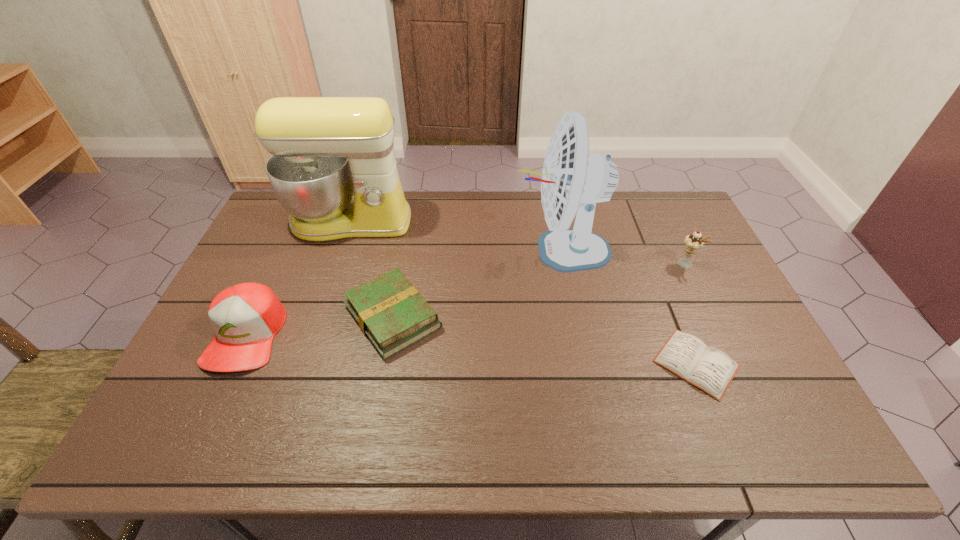
Locate an element on the screen. This screenshot has width=960, height=540. object at the far left corner is located at coordinates (324, 149).

Identify the location of vacant space at the far edge. This screenshot has height=540, width=960. (459, 230).

Find the location of `free location at the near edge of the desktop`. free location at the near edge of the desktop is located at coordinates (635, 419).

Locate an element on the screen. This screenshot has height=540, width=960. vacant space at the left edge of the desktop is located at coordinates (201, 393).

In the image, there is a desktop. Identify the location of free region at the right edge. This screenshot has height=540, width=960. [x=768, y=411].

Locate an element on the screen. The height and width of the screenshot is (540, 960). vacant region at the far right corner is located at coordinates (643, 198).

The height and width of the screenshot is (540, 960). Find the location of `blank space at the near right corner of the desktop`. blank space at the near right corner of the desktop is located at coordinates (752, 418).

At what (x,y) coordinates should I click in order to perform the action: click on unoccupied area between the baseball cap and the mixer. Please return your answer as a coordinate pair (x, y). This screenshot has width=960, height=540. Looking at the image, I should click on (298, 278).

The width and height of the screenshot is (960, 540). I want to click on vacant point located between the fourth object from left to right and the mixer, so click(455, 236).

You are a GUI agent. You are given a task and a screenshot of the screen. Output one action in this format:
    pyautogui.click(x=<x>, y=<y>)
    Task: Click on the free point between the shortest object and the mixer
    This screenshot has width=960, height=540.
    Given the screenshot: What is the action you would take?
    pyautogui.click(x=523, y=292)